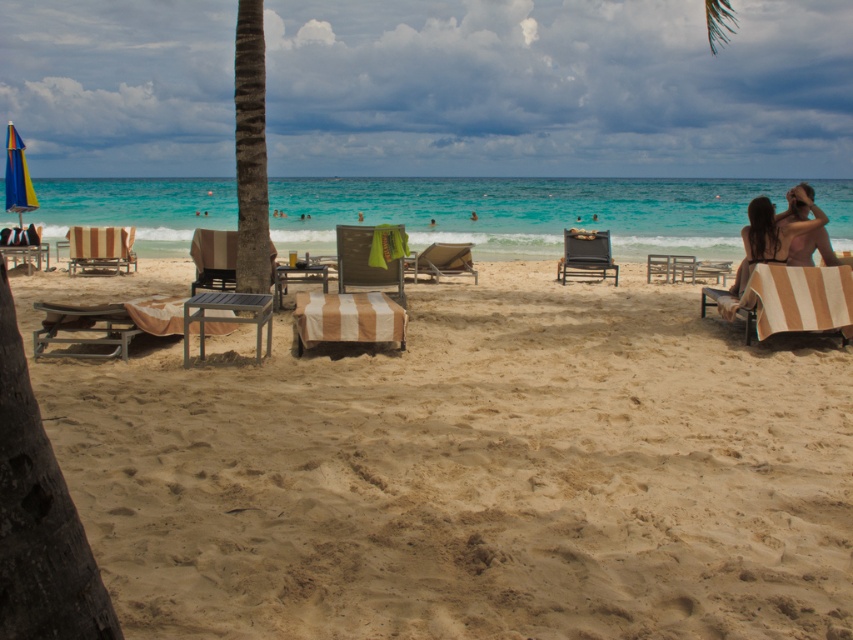
Question: Which point appears farthest from the camera in this image?

Choices:
 (A) (346, 256)
 (B) (212, 260)

Answer: (B)

Question: Which object appears closest to the camera in this image?

Choices:
 (A) matte black beach chair at center
 (B) wooden slatted beach chair at center

Answer: (B)

Question: Is striped fabric beach chair at center positioned at the back of beige striped beach chair at center?

Choices:
 (A) no
 (B) yes

Answer: (A)

Question: Which object appears closest to the camera in this image?

Choices:
 (A) beige sandy beach at center
 (B) green leafy palm tree at center-left
 (C) beige striped lounge chair at right
 (D) beige striped beach chair at center

Answer: (A)

Question: Is beige sandy beach at center below matte black beach chair at center?

Choices:
 (A) no
 (B) yes

Answer: (B)

Question: Where is beige sandy beach at center located in relation to beige striped beach chair at center in the image?

Choices:
 (A) below
 (B) above

Answer: (A)